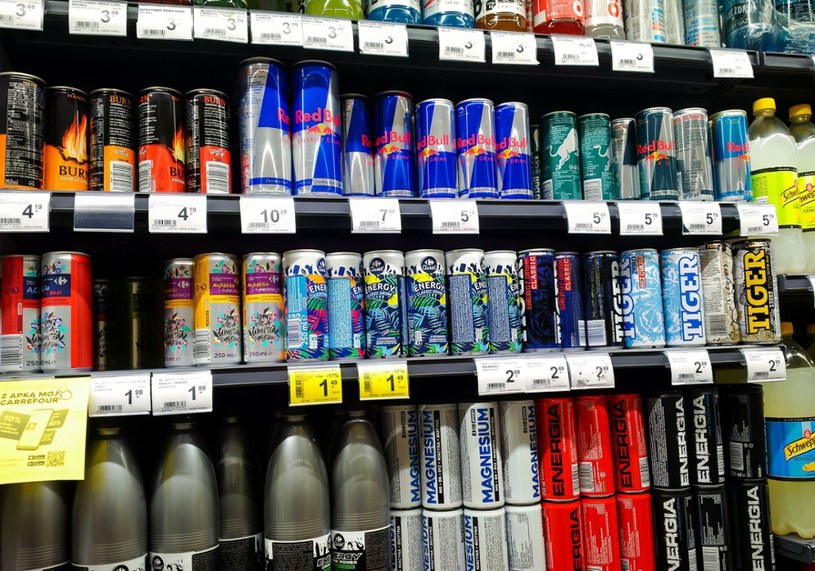
Find the location of a particular element. This screenshot has width=815, height=571. red cans on the bottom shelf is located at coordinates (553, 464), (562, 538), (593, 462), (601, 526), (627, 470), (632, 526).